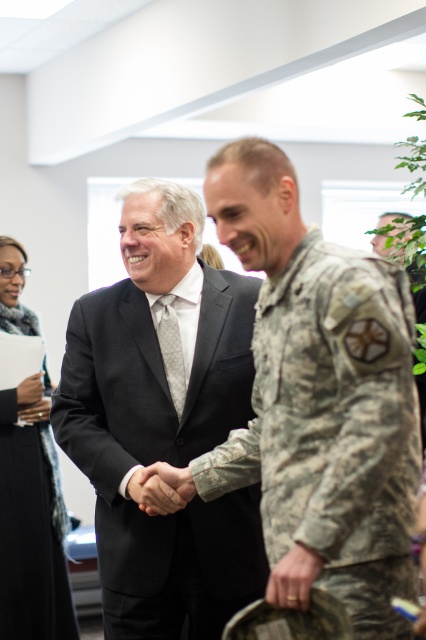
Who is lower down, camouflage uniform at center or black textured coat at lower left?

black textured coat at lower left is lower down.

Looking at this image, does camouflage uniform at center have a lesser height compared to black textured coat at lower left?

Yes.

Which is behind, point (279, 237) or point (8, 598)?

Positioned behind is point (8, 598).

Find the location of a particular element. The height and width of the screenshot is (640, 426). camouflage uniform at center is located at coordinates (317, 401).

Who is shorter, black matte suit at center or black textured coat at lower left?

black matte suit at center

How much distance is there between black matte suit at center and black textured coat at lower left?

The distance of black matte suit at center from black textured coat at lower left is 1.55 meters.

Is point (203, 268) less distant than point (6, 275)?

Yes, it is.

This screenshot has height=640, width=426. What are the coordinates of `black matte suit at center` in the screenshot? It's located at (163, 420).

Based on the photo, between camouflage uniform at center and black matte suit at center, which one appears on the left side from the viewer's perspective?

black matte suit at center

Can you confirm if camouflage uniform at center is taller than black matte suit at center?

No.

Does point (383, 305) come behind point (206, 308)?

That is False.

You are a GUI agent. You are given a task and a screenshot of the screen. Output one action in this format:
    pyautogui.click(x=<x>, y=<y>)
    Task: Click on the camouflage uniform at center
    
    Given the screenshot: What is the action you would take?
    click(317, 401)